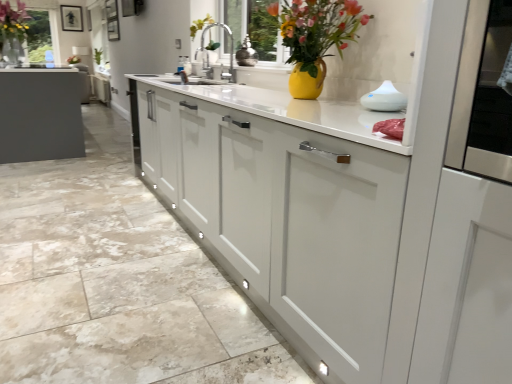
Question: From a real-world perspective, is matte white cabinet at center, the 2th cabinetry when ordered from top to bottom, located higher than white matte cabinet at center, which appears as the first cabinetry when viewed from the back?

Choices:
 (A) yes
 (B) no

Answer: (B)

Question: Can you confirm if matte white cabinet at center, the 1th cabinetry positioned from the front, is positioned to the left of white matte cabinet at center, which appears as the first cabinetry when viewed from the back?

Choices:
 (A) no
 (B) yes

Answer: (A)

Question: Is matte white cabinet at center, which is the first cabinetry in bottom-to-top order, smaller than white matte cabinet at center, marked as the 2th cabinetry in a front-to-back arrangement?

Choices:
 (A) no
 (B) yes

Answer: (A)

Question: Does matte white cabinet at center, the 2th cabinetry when ordered from top to bottom, touch white matte cabinet at center, positioned as the second cabinetry in bottom-to-top order?

Choices:
 (A) no
 (B) yes

Answer: (A)

Question: Is matte white cabinet at center, the 1th cabinetry positioned from the front, not close to white matte cabinet at center, which is the 1th cabinetry in top-to-bottom order?

Choices:
 (A) yes
 (B) no

Answer: (A)

Question: From the image's perspective, relative to matte black vase at upper left, the 1th floral arrangement from the top, is white matte cabinet at center, which appears as the first cabinetry when viewed from the back, above or below?

Choices:
 (A) above
 (B) below

Answer: (A)

Question: Looking at their shapes, would you say white matte cabinet at center, which appears as the first cabinetry when viewed from the back, is wider or thinner than matte black vase at upper left, the 1th floral arrangement from the top?

Choices:
 (A) thin
 (B) wide

Answer: (A)

Question: From a real-world perspective, is white matte cabinet at center, marked as the 2th cabinetry in a front-to-back arrangement, above or below matte black vase at upper left, the 1th floral arrangement from the top?

Choices:
 (A) above
 (B) below

Answer: (B)

Question: Do you think white matte cabinet at center, which is the 1th cabinetry in top-to-bottom order, is within matte black vase at upper left, acting as the 1th floral arrangement starting from the back, or outside of it?

Choices:
 (A) inside
 (B) outside

Answer: (B)

Question: Considering the relative positions of matte black picture frame at upper center and matte white cabinet at center, the 2th cabinetry when ordered from top to bottom, in the image provided, is matte black picture frame at upper center to the left or to the right of matte white cabinet at center, the 2th cabinetry when ordered from top to bottom,?

Choices:
 (A) right
 (B) left

Answer: (B)

Question: Based on their sizes in the image, would you say matte black picture frame at upper center is bigger or smaller than matte white cabinet at center, which is the first cabinetry in bottom-to-top order?

Choices:
 (A) big
 (B) small

Answer: (B)

Question: Considering the positions of point (64, 8) and point (249, 173), is point (64, 8) closer or farther from the camera than point (249, 173)?

Choices:
 (A) closer
 (B) farther

Answer: (B)

Question: Is matte black picture frame at upper center in front of or behind matte white cabinet at center, placed as the second cabinetry when sorted from back to front, in the image?

Choices:
 (A) front
 (B) behind

Answer: (B)

Question: From their relative heights in the image, would you say white matte cabinet at center, marked as the 2th cabinetry in a front-to-back arrangement, is taller or shorter than matte black picture frame at upper center?

Choices:
 (A) short
 (B) tall

Answer: (A)

Question: Does point click(x=100, y=77) appear closer or farther from the camera than point click(x=66, y=16)?

Choices:
 (A) farther
 (B) closer

Answer: (B)